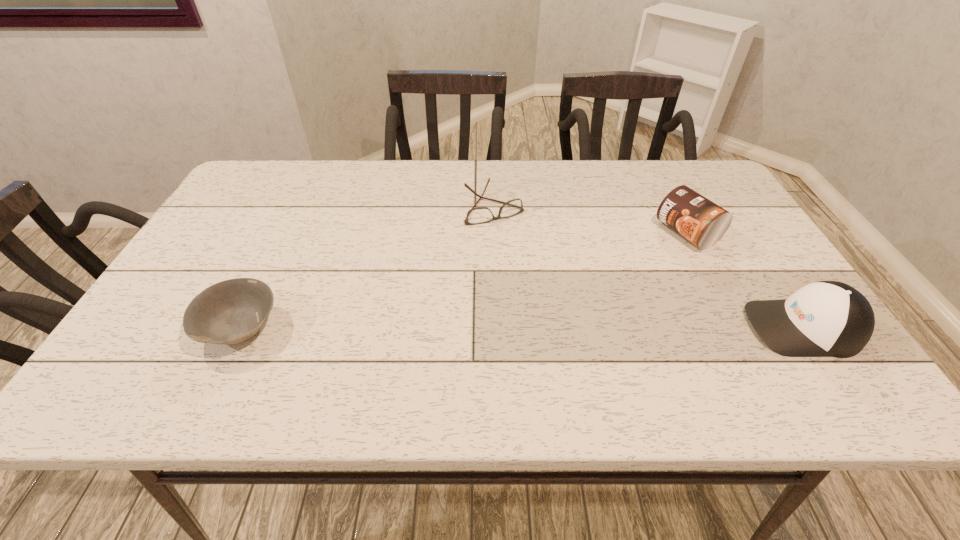
You are a GUI agent. You are given a task and a screenshot of the screen. Output one action in this format:
    pyautogui.click(x=<x>, y=<y>)
    Task: Click on the object that is the second closest one to the can
    
    Given the screenshot: What is the action you would take?
    pyautogui.click(x=480, y=215)

Select which object appears as the second closest to the bowl. Please provide its 2D coordinates. Your answer should be formatted as a tuple, i.e. [(x, y)], where the tuple contains the x and y coordinates of a point satisfying the conditions above.

[(702, 222)]

The width and height of the screenshot is (960, 540). Identify the location of free space that satisfies the following two spatial constraints: 1. on the front side of the can; 2. on the front panel of the cap. (735, 327).

Locate an element on the screen. free space that satisfies the following two spatial constraints: 1. on the front side of the cap; 2. on the front panel of the spectacles is located at coordinates (498, 327).

Find the location of a particular element. This screenshot has width=960, height=540. vacant space that satisfies the following two spatial constraints: 1. on the front side of the cap; 2. on the front panel of the spectacles is located at coordinates (498, 327).

Where is `vacant point that satisfies the following two spatial constraints: 1. on the front side of the cap; 2. on the front panel of the leftmost object`? This screenshot has width=960, height=540. vacant point that satisfies the following two spatial constraints: 1. on the front side of the cap; 2. on the front panel of the leftmost object is located at coordinates (240, 327).